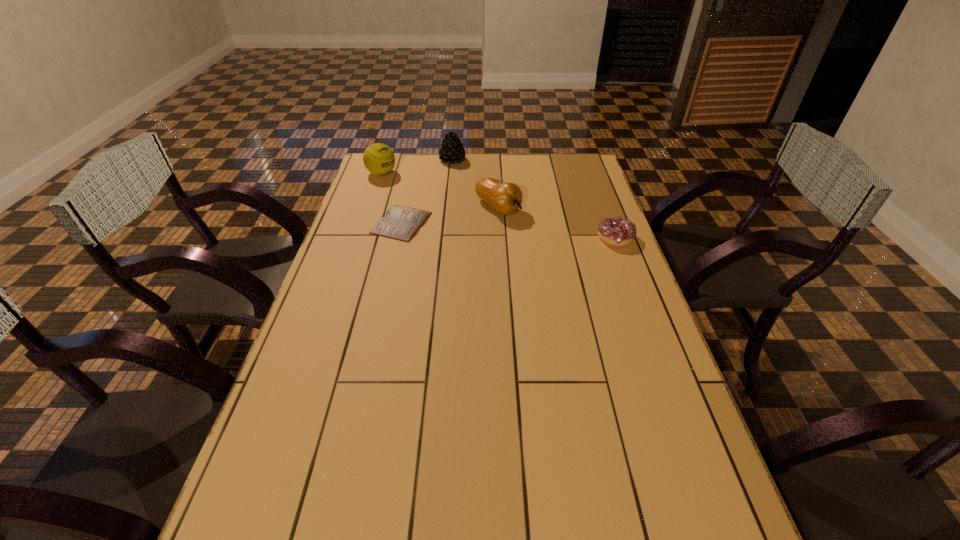
In order to click on softball located at the left edge in this screenshot , I will do (x=378, y=158).

Identify the location of object situated at the right edge. (615, 231).

Identify the location of object that is at the far left corner. (378, 158).

The width and height of the screenshot is (960, 540). In order to click on free location at the far edge of the desktop in this screenshot , I will do `click(462, 172)`.

Find the location of a particular element. free space at the near edge of the desktop is located at coordinates (501, 488).

In the image, there is a desktop. Where is `blank space at the left edge`? The height and width of the screenshot is (540, 960). blank space at the left edge is located at coordinates (344, 247).

Image resolution: width=960 pixels, height=540 pixels. In the image, there is a desktop. Identify the location of vacant region at the right edge. pos(669,416).

Locate an element on the screen. The height and width of the screenshot is (540, 960). vacant space at the near left corner of the desktop is located at coordinates (257, 510).

Identify the location of vacant point located between the pinecone and the softball. The image size is (960, 540). (417, 167).

At what (x,y) coordinates should I click in order to perform the action: click on unoccupied area between the gourd and the diary. Please return your answer as a coordinate pair (x, y). The image size is (960, 540). Looking at the image, I should click on (450, 215).